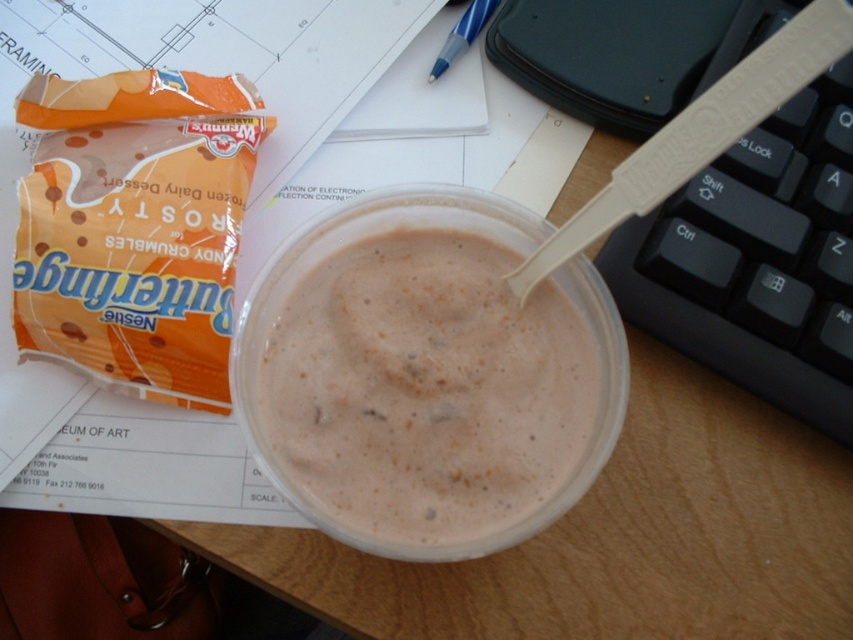
Please provide the coordinates of the white creamy pudding at center in the image.

The white creamy pudding at center is located at coordinates point (427, 376).

You are organizing your desk and want to place the blue plastic pen at upper center closer to you. To do this, do you need to move the white creamy pudding at center out of the way?

The white creamy pudding at center is in front of the blue plastic pen at upper center, so you need to move the white creamy pudding at center to access the blue plastic pen at upper center.